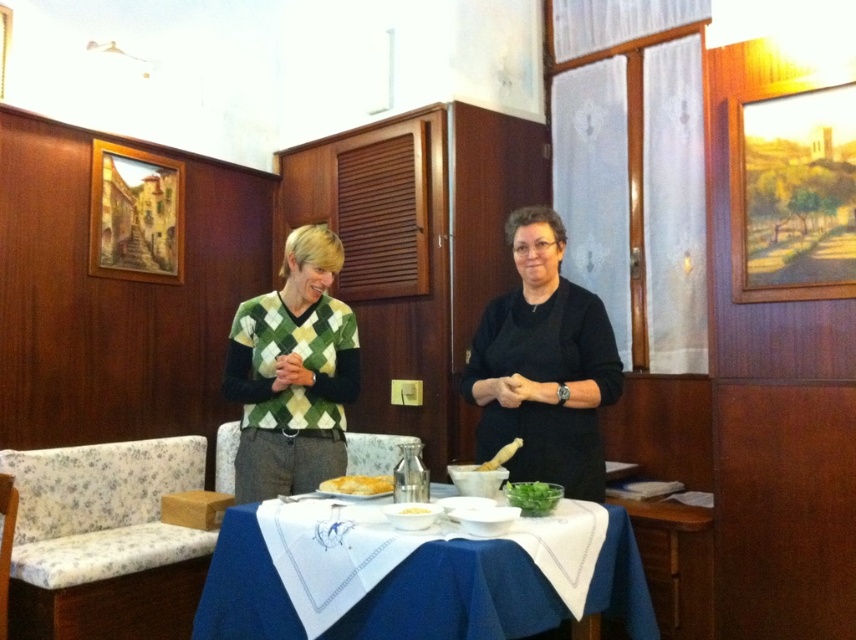
You are a fashion designer attending a presentation in a restaurant. You notice a point marked at coordinates (544, 365) on the table. What item is located at this specific coordinate?

The point at coordinates (544, 365) marks the location of the black matte dress at center.

You are a customer sitting at the blue fabric table at center and want to reach the green argyle sweater at center. Can you easily reach it from your seat?

The blue fabric table at center is shorter than green argyle sweater at center, so the green argyle sweater at center is taller than the table. This means the sweater is likely placed above the table, making it difficult to reach from your seated position.

You are planning to place a decorative centerpiece on the blue fabric table at center. Given that the table is positioned at coordinates point 0.909, 0.480, can you confirm if there is enough space for the centerpiece without overlapping any existing items?

The blue fabric table at center is located at point (409, 580), but the provided information does not specify the dimensions or arrangement of existing items on the table. Therefore, it is uncertain if there is sufficient space for the centerpiece without overlapping.